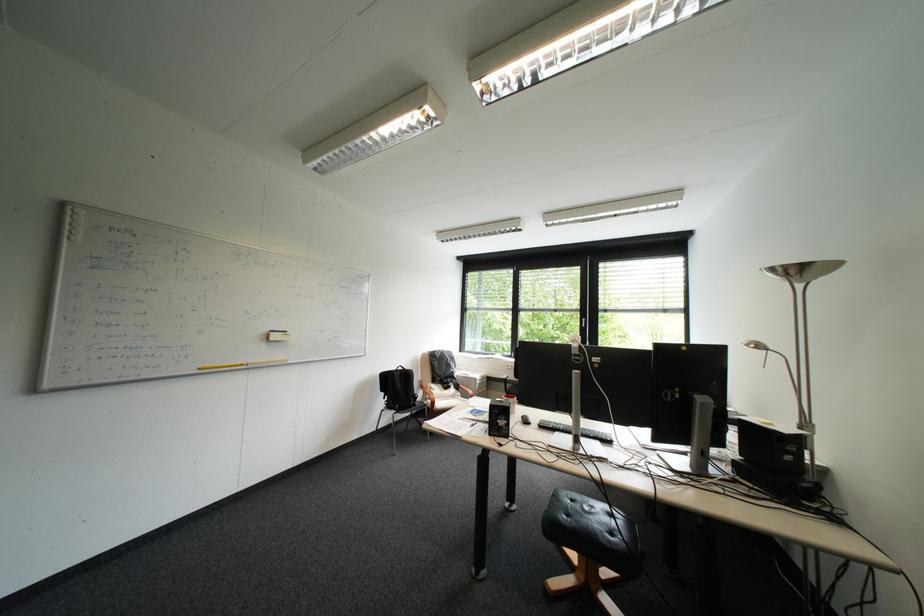
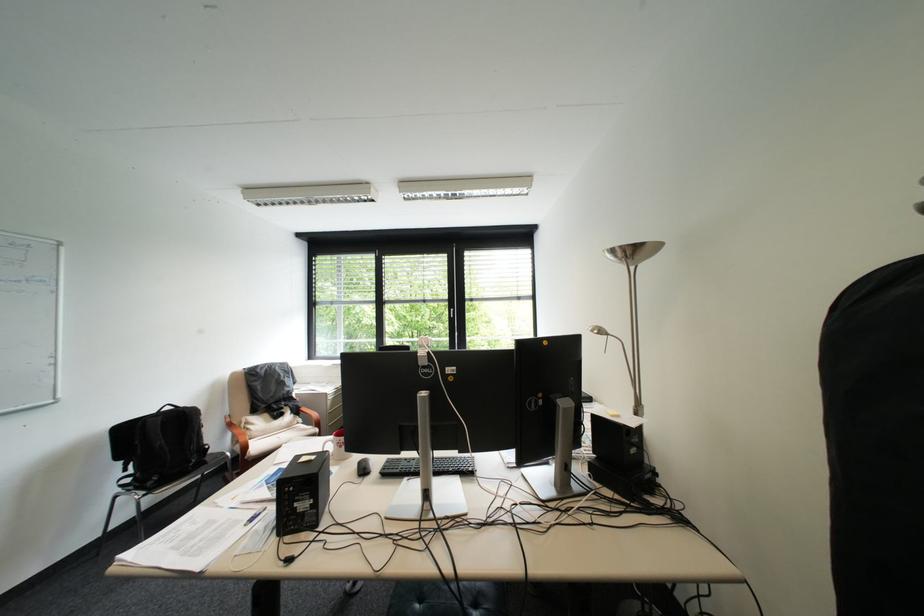
The images are taken continuously from a first-person perspective. In which direction are you moving?

The cameraman walked toward right, forward.